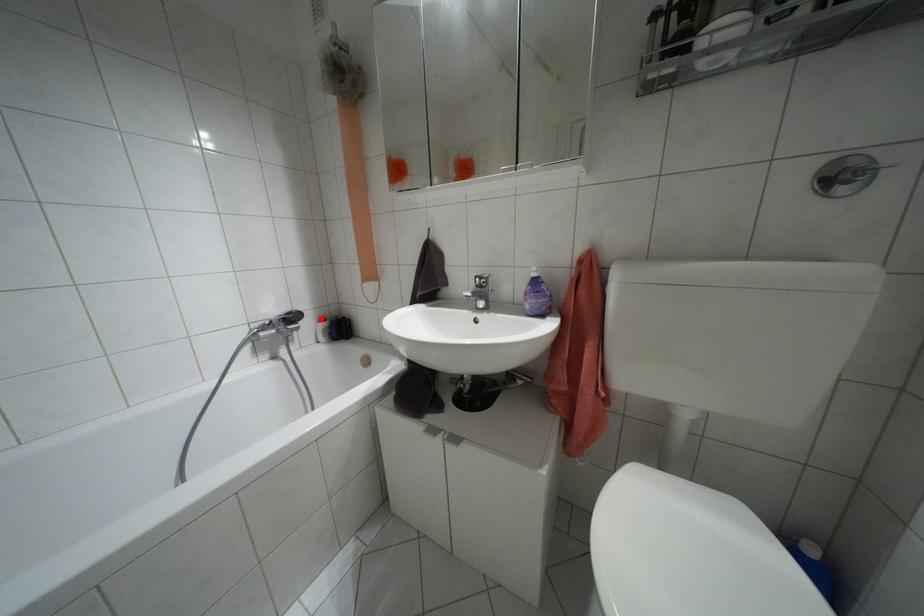
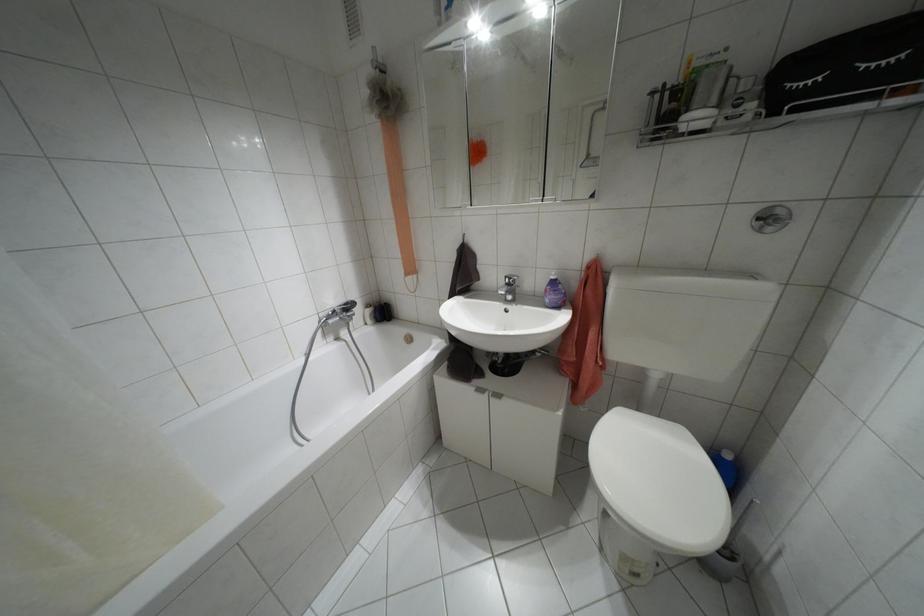
Question: I am providing you with two images of the same scene from different viewpoints. A red point is marked on the first image. At the location where the point appears in image 1, is it still visible in image 2?

Choices:
 (A) Yes
 (B) No

Answer: (A)